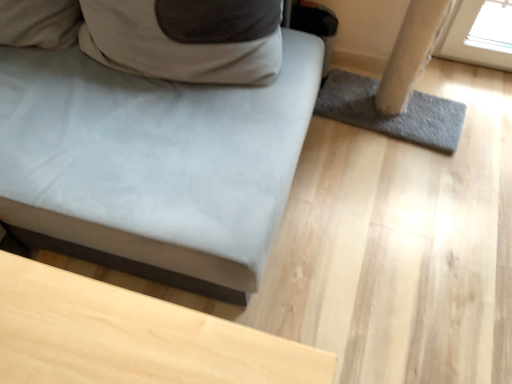
The image size is (512, 384). What do you see at coordinates (152, 165) in the screenshot? I see `light wood table at lower left` at bounding box center [152, 165].

Find the location of a particular element. The width and height of the screenshot is (512, 384). light wood table at lower left is located at coordinates (152, 165).

Locate an element on the screen. The width and height of the screenshot is (512, 384). light wood table at lower left is located at coordinates (152, 165).